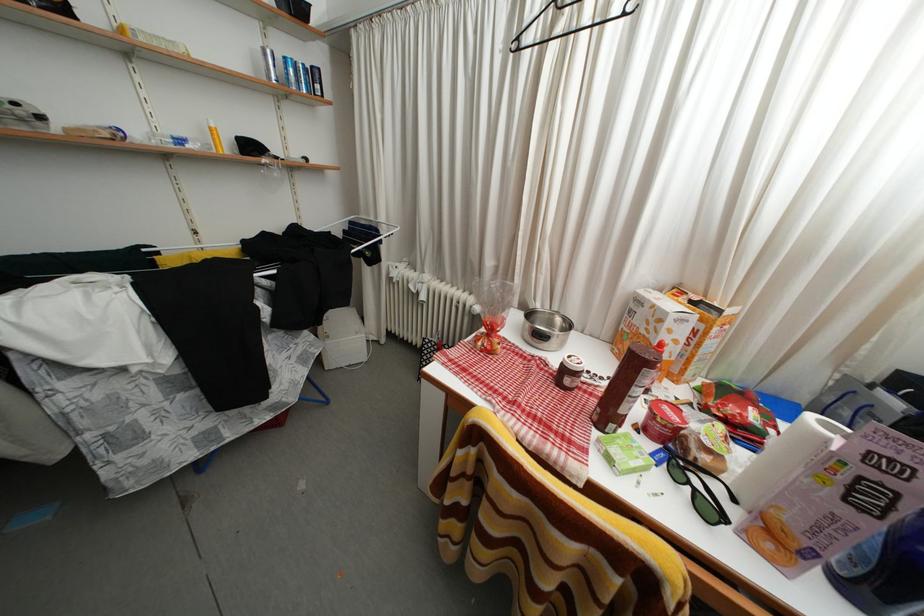
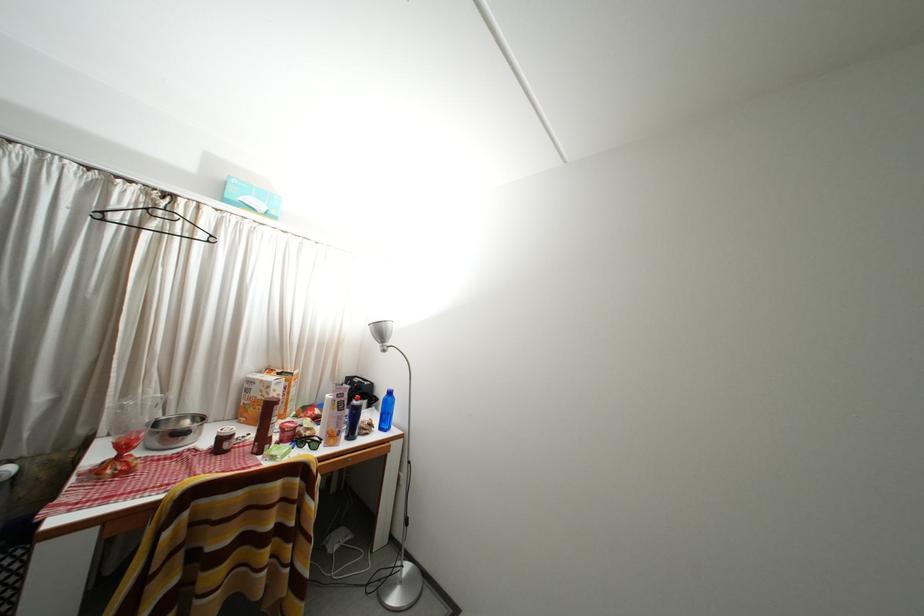
Question: Based on the continuous images, in which direction is the camera rotating? Reply with the corresponding letter.

Choices:
 (A) Left
 (B) Right
 (C) Up
 (D) Down

Answer: (B)